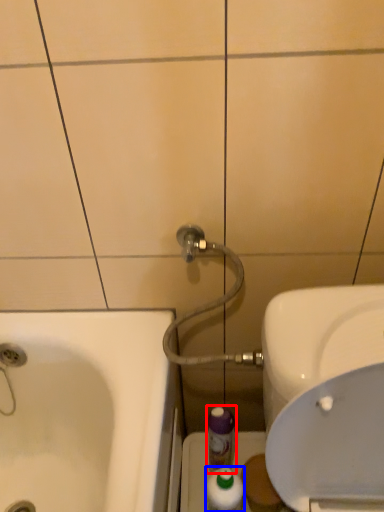
Question: Which of the following is the farthest to the observer, mouthwash (highlighted by a red box) or mouthwash (highlighted by a blue box)?

Choices:
 (A) mouthwash
 (B) mouthwash

Answer: (A)